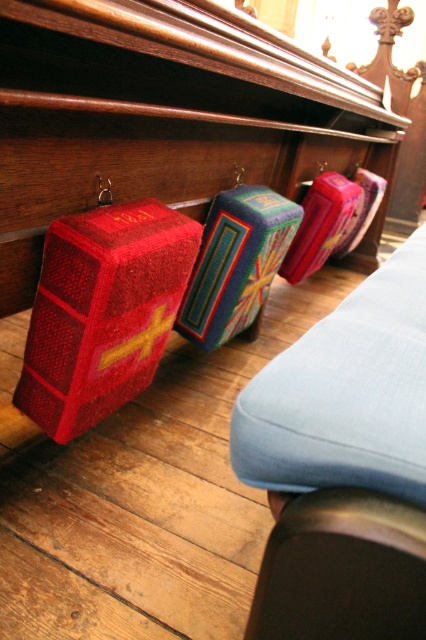
Is matte blue cushion at center smaller than velvet red book at left?

Incorrect, matte blue cushion at center is not smaller in size than velvet red book at left.

Between matte blue cushion at center and velvet red book at left, which one has less height?

Standing shorter between the two is velvet red book at left.

Locate an element on the screen. matte blue cushion at center is located at coordinates (344, 465).

Where is `matte blue cushion at center`? Image resolution: width=426 pixels, height=640 pixels. matte blue cushion at center is located at coordinates (344, 465).